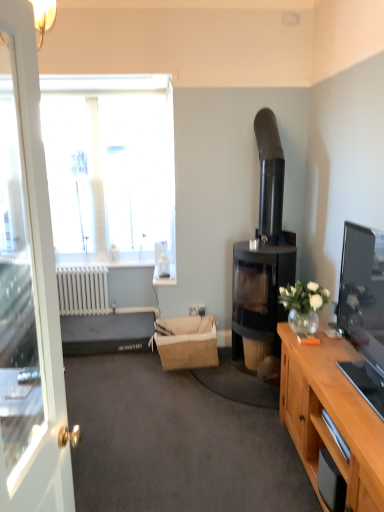
Question: Is white glossy door at left in front of or behind transparent glass window at upper left in the image?

Choices:
 (A) behind
 (B) front

Answer: (B)

Question: Is white glossy door at left taller or shorter than transparent glass window at upper left?

Choices:
 (A) tall
 (B) short

Answer: (B)

Question: Which is farther from the brown woven picnic basket at center?

Choices:
 (A) white plastic power outlet at center
 (B) white painted metal radiator at lower left
 (C) transparent glass window at upper left
 (D) dark gray fabric bed at lower left
 (E) black glass fireplace at right

Answer: (C)

Question: Estimate the real-world distances between objects in this image. Which object is farther from the transparent glass window at upper left?

Choices:
 (A) white painted metal radiator at lower left
 (B) white plastic power outlet at center
 (C) brown woven picnic basket at center
 (D) black glass fireplace at right
 (E) dark gray fabric bed at lower left

Answer: (D)